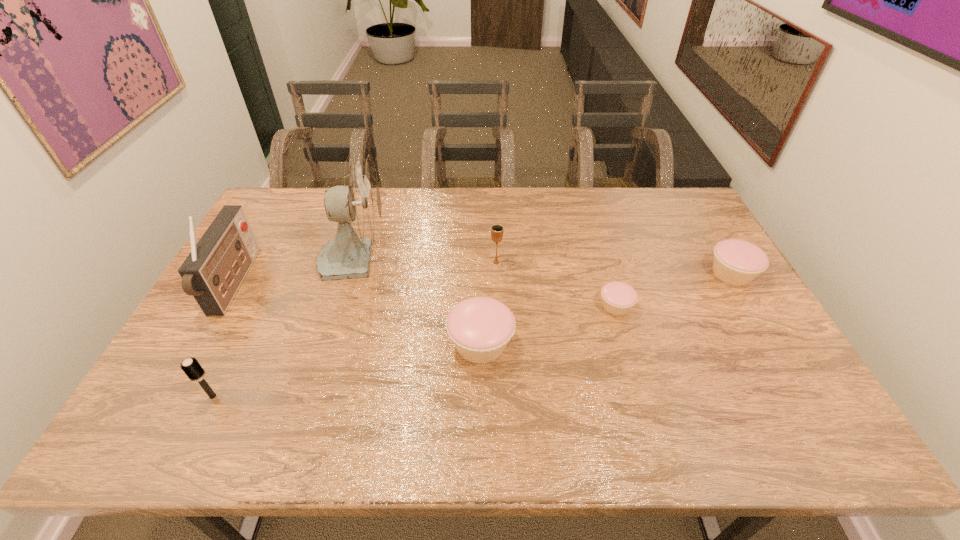
Identify the location of the second object from left to right. The image size is (960, 540). pyautogui.click(x=191, y=367).

The height and width of the screenshot is (540, 960). In order to click on hairbrush in this screenshot , I will do `click(191, 367)`.

The height and width of the screenshot is (540, 960). I want to click on free space located on the right of the leftmost cupcake, so click(x=598, y=344).

Where is `vacant space positioned 0.080m on the front of the second cupcake from left to right`? Image resolution: width=960 pixels, height=540 pixels. vacant space positioned 0.080m on the front of the second cupcake from left to right is located at coordinates (627, 343).

You are a GUI agent. You are given a task and a screenshot of the screen. Output one action in this format:
    pyautogui.click(x=<x>, y=<y>)
    Task: Click on the free space located 0.240m on the front of the rightmost object
    
    Given the screenshot: What is the action you would take?
    pyautogui.click(x=782, y=360)

I want to click on vacant space situated on the front panel of the leftmost object, so click(x=299, y=284).

Where is `vacant space located 0.150m in front of the fifth object from right to left to blow air`? The width and height of the screenshot is (960, 540). vacant space located 0.150m in front of the fifth object from right to left to blow air is located at coordinates (439, 259).

The height and width of the screenshot is (540, 960). In order to click on vacant space located on the back of the chalice in this screenshot , I will do `click(494, 214)`.

At what (x,y) coordinates should I click in order to perform the action: click on free space located on the back of the hairbrush. Please return your answer as a coordinate pair (x, y). This screenshot has width=960, height=540. Looking at the image, I should click on (273, 274).

Identify the location of cupcake located in the near edge section of the desktop. [480, 327].